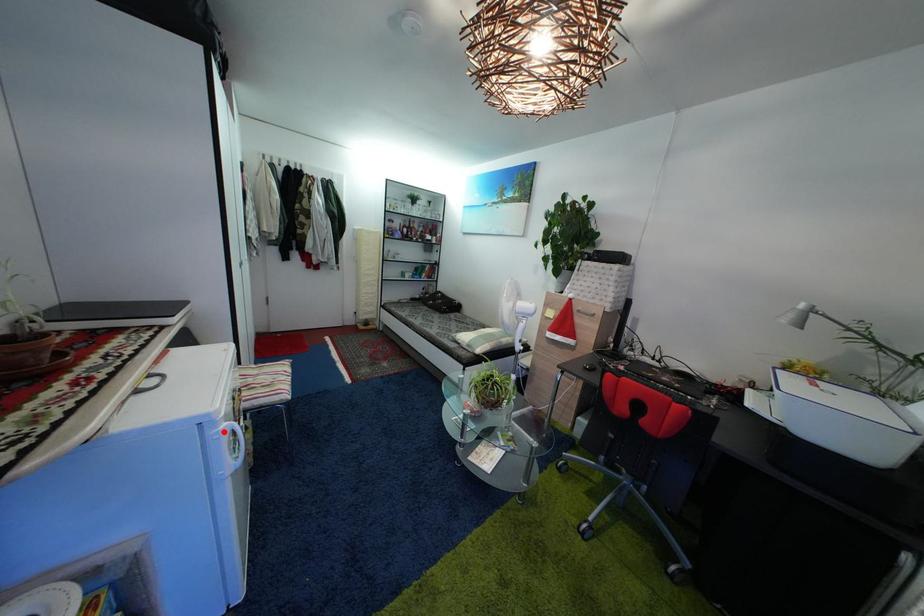
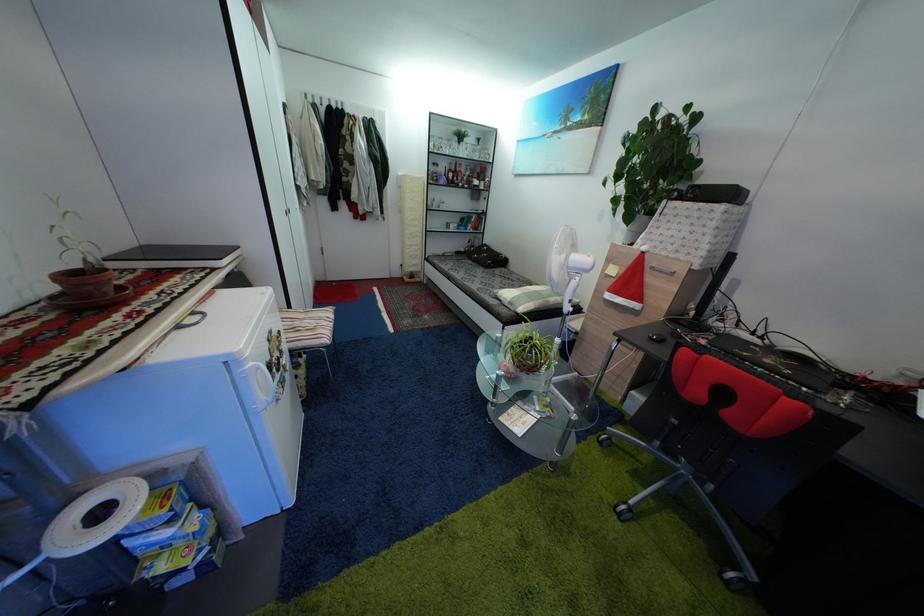
Where in the second image is the point corresponding to the highlighted location from the first image?

(249, 371)